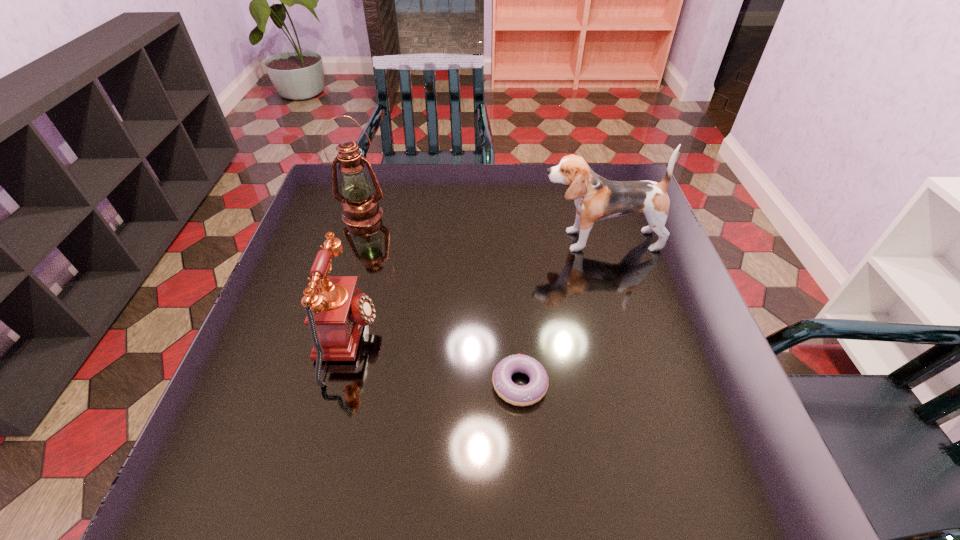
Where is `free space at the right edge of the desktop`? The width and height of the screenshot is (960, 540). free space at the right edge of the desktop is located at coordinates pos(670,251).

Identify the location of vacant point located between the doughnut and the third tallest object. The width and height of the screenshot is (960, 540). (434, 362).

Identify the location of vacant space that's between the oil lamp and the doughnut. (442, 299).

At what (x,y) coordinates should I click in order to perform the action: click on free spot between the second shortest object and the rightmost object. Please return your answer as a coordinate pair (x, y). The image size is (960, 540). Looking at the image, I should click on (473, 290).

Where is `empty location between the farthest object and the shortest object`? The height and width of the screenshot is (540, 960). empty location between the farthest object and the shortest object is located at coordinates (442, 299).

The image size is (960, 540). In order to click on free spot between the rightmost object and the third tallest object in this screenshot , I will do `click(473, 290)`.

At what (x,y) coordinates should I click in order to perform the action: click on vacant area that lies between the farthest object and the rightmost object. Please return your answer as a coordinate pair (x, y). Looking at the image, I should click on (481, 227).

At what (x,y) coordinates should I click in order to perform the action: click on free spot between the telephone and the third object from left to right. Please return your answer as a coordinate pair (x, y). Looking at the image, I should click on (434, 362).

Where is `vacant space that's between the rightmost object and the telephone`? This screenshot has width=960, height=540. vacant space that's between the rightmost object and the telephone is located at coordinates (473, 290).

Where is `object that can be found as the closest to the rightmost object`? This screenshot has height=540, width=960. object that can be found as the closest to the rightmost object is located at coordinates (534, 391).